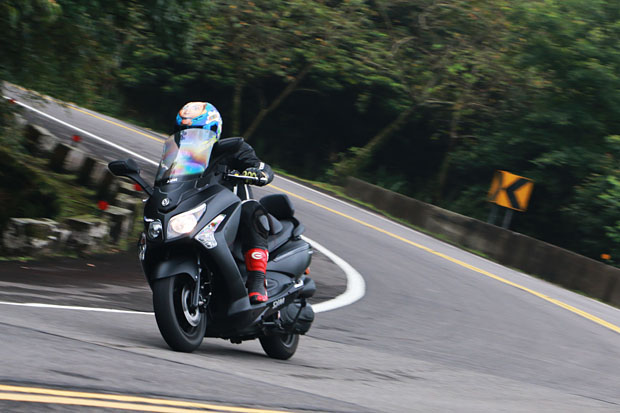
You are a GUI agent. You are given a task and a screenshot of the screen. Output one action in this format:
    pyautogui.click(x=<x>, y=<y>)
    Task: Click on the side wall
    Image resolution: width=620 pixels, height=413 pixels.
    Given the screenshot: What is the action you would take?
    pyautogui.click(x=377, y=197), pyautogui.click(x=454, y=213), pyautogui.click(x=564, y=258), pyautogui.click(x=609, y=286)